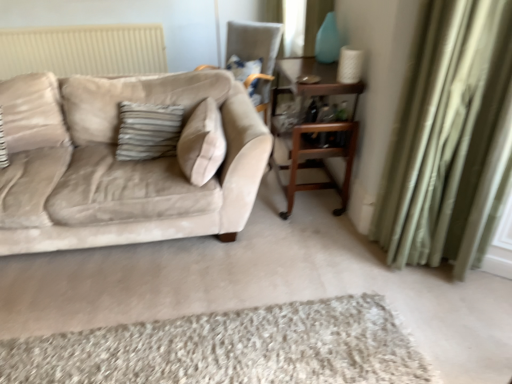
Find the location of a particular element. The image size is (512, 384). vacant space situated above shaggy beige rug at lower center (from a real-world perspective) is located at coordinates (216, 348).